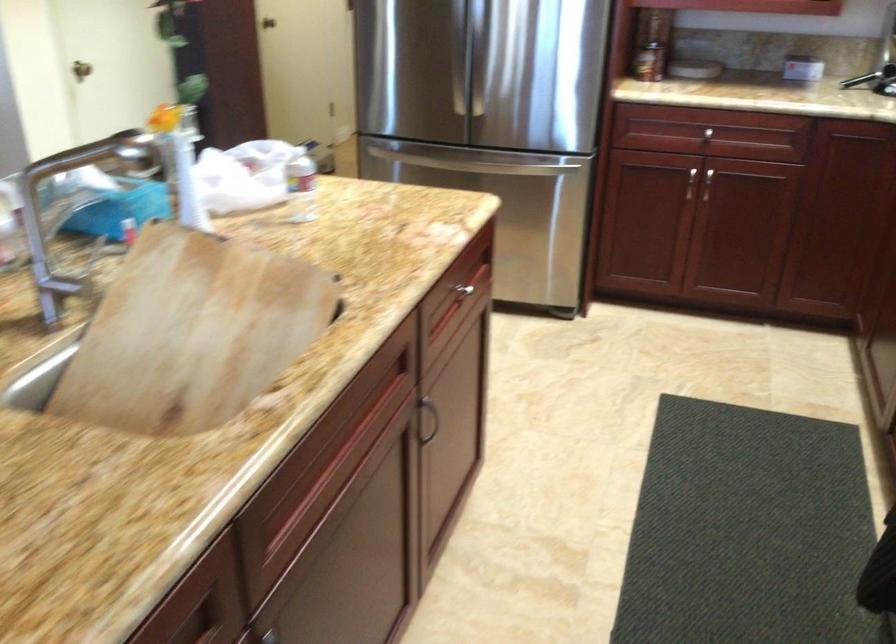
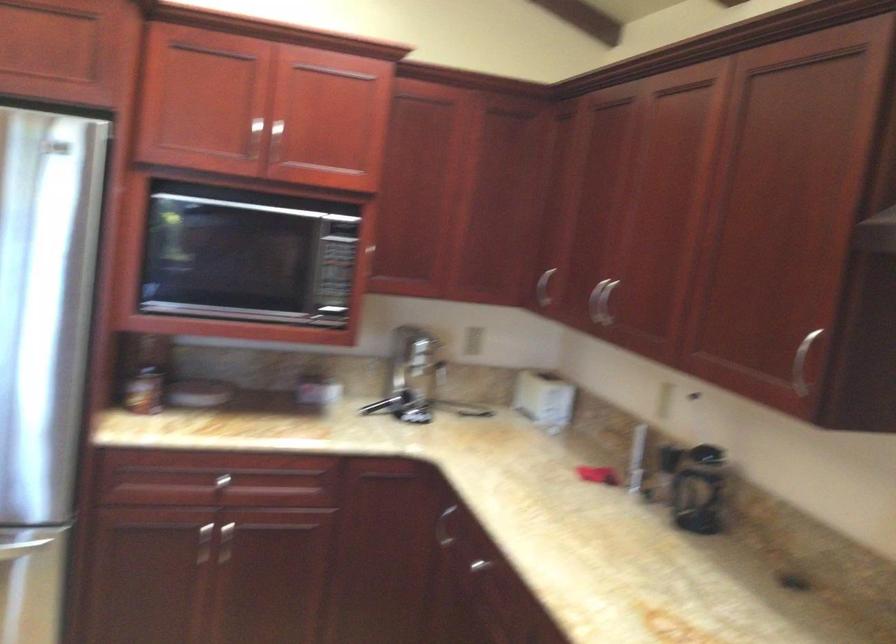
How did the camera likely rotate?

The rotation direction of the camera is right-up.